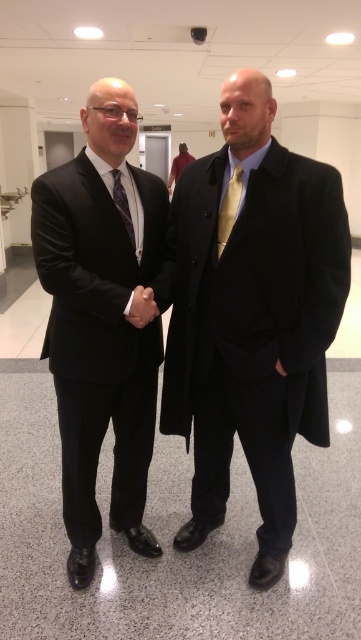
Question: Which point is closer to the camera?

Choices:
 (A) matte black tie at center
 (B) matte black coat at center

Answer: (B)

Question: Which of the following is the closest to the observer?

Choices:
 (A) matte black tie at center
 (B) matte black hand at center
 (C) matte black coat at center
 (D) matte black suit at left

Answer: (C)

Question: Is the position of matte black suit at left less distant than that of matte black hand at center?

Choices:
 (A) yes
 (B) no

Answer: (A)

Question: Does matte black suit at left come behind gold silk tie at center?

Choices:
 (A) yes
 (B) no

Answer: (B)

Question: Which object appears closest to the camera in this image?

Choices:
 (A) matte black tie at center
 (B) gold silk tie at center
 (C) matte black coat at center

Answer: (C)

Question: Is matte black coat at center positioned at the back of matte black hand at center?

Choices:
 (A) no
 (B) yes

Answer: (A)